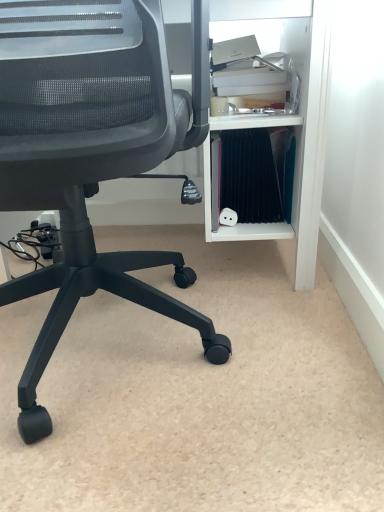
You are a GUI agent. You are given a task and a screenshot of the screen. Output one action in this format:
    pyautogui.click(x=<x>, y=<y>)
    Task: Click on the unoccupied region to the right of black mesh chair at left
    The image size is (384, 512).
    Given the screenshot: What is the action you would take?
    pyautogui.click(x=293, y=364)